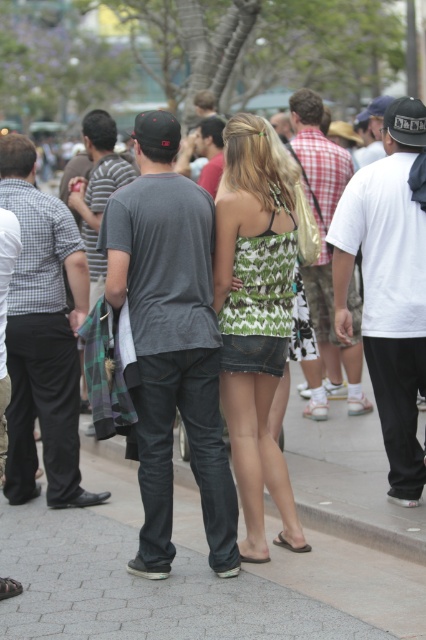
Question: Does white cotton t-shirt at right come behind white cotton shirt at center?

Choices:
 (A) no
 (B) yes

Answer: (A)

Question: Estimate the real-world distances between objects in this image. Which object is closer to the matte gray t-shirt at left?

Choices:
 (A) dark gray t-shirt at center
 (B) white cotton t-shirt at right
 (C) dark gray cotton t-shirt at center
 (D) white cotton shirt at center

Answer: (C)

Question: Which point is closer to the camera?

Choices:
 (A) white cotton t-shirt at right
 (B) matte gray t-shirt at left
 (C) printed fabric dress at center

Answer: (C)

Question: Can you confirm if matte gray t-shirt at left is positioned above dark gray t-shirt at center?

Choices:
 (A) yes
 (B) no

Answer: (B)

Question: Is printed fabric dress at center to the left of white cotton t-shirt at right from the viewer's perspective?

Choices:
 (A) yes
 (B) no

Answer: (A)

Question: Which point appears farthest from the camera in this image?

Choices:
 (A) (327, 141)
 (B) (100, 170)
 (C) (164, 266)

Answer: (A)